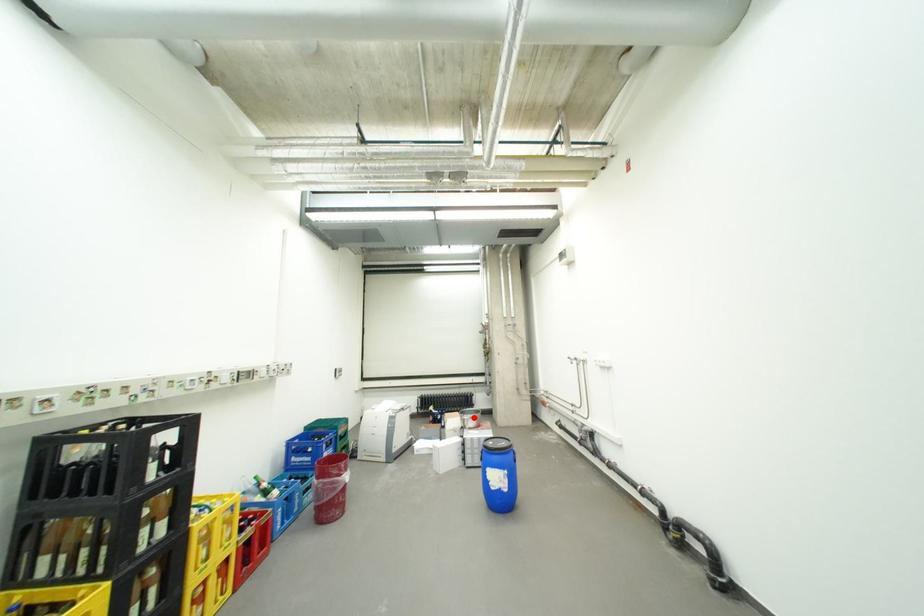
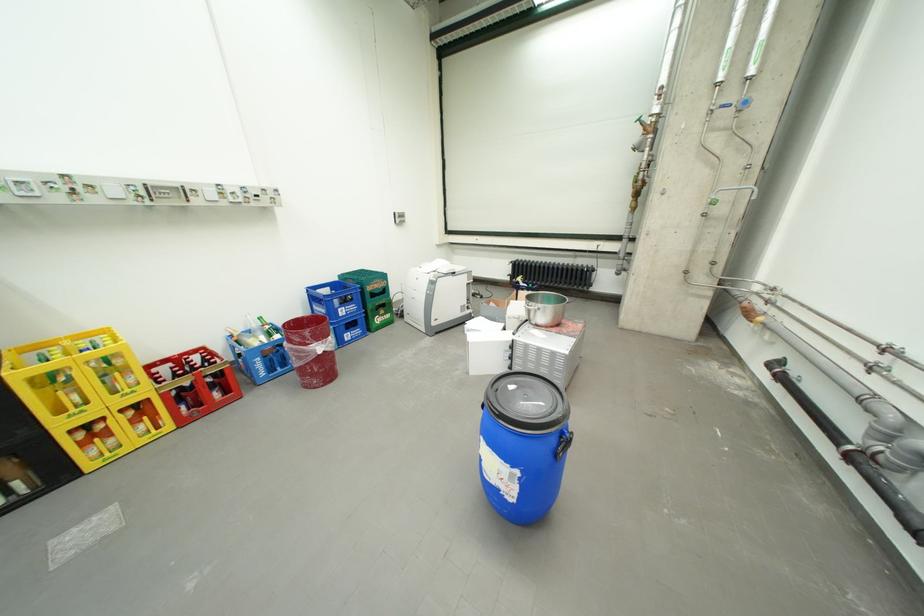
Question: I am providing you with two images of the same scene from different viewpoints. In image1, a red point is highlighted. Considering the same 3D point in image2, which of the following is correct?

Choices:
 (A) It is closer
 (B) It is farther

Answer: (A)